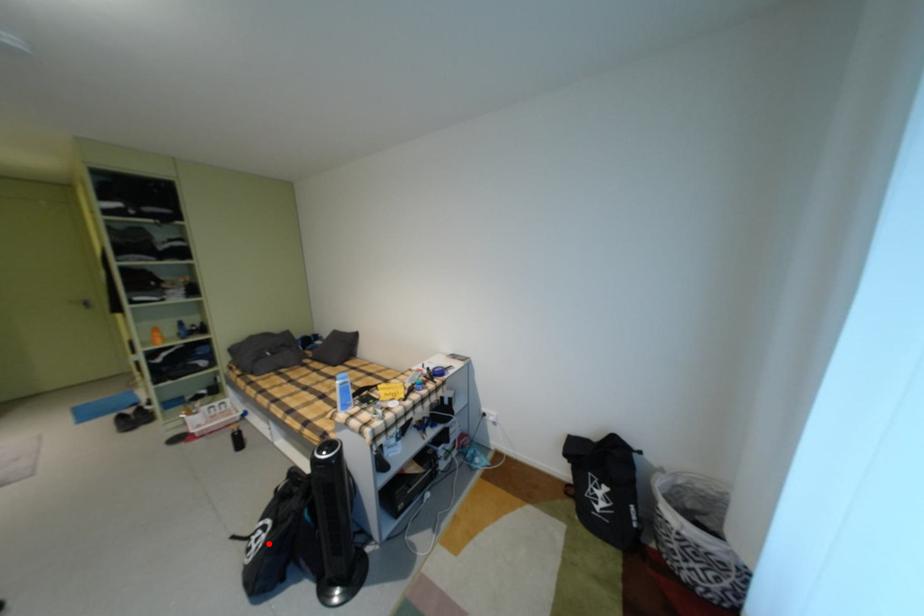
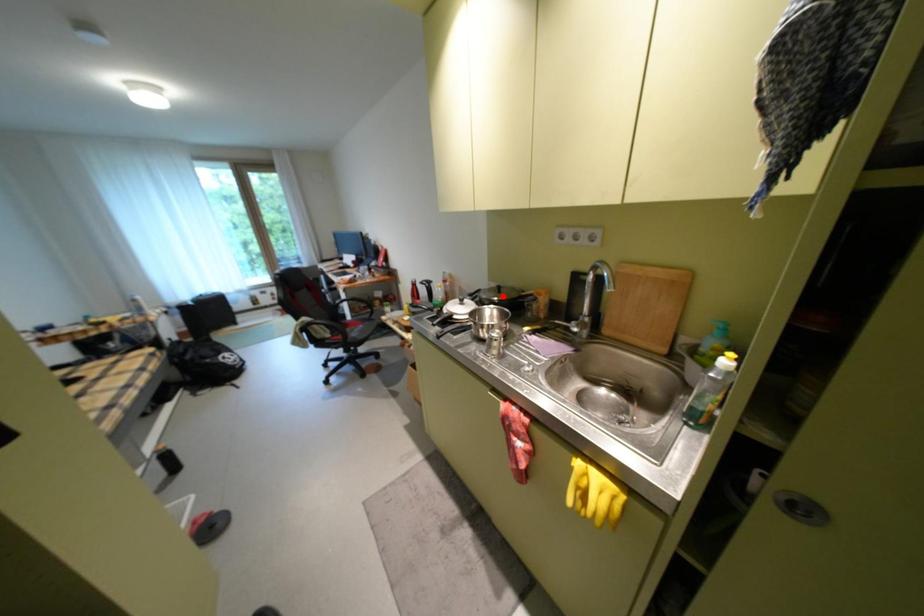
I am providing you with two images of the same scene from different viewpoints. A red point is marked on the first image and another point is marked on the second image. Is the marked point in image1 the same physical position as the marked point in image2?

No